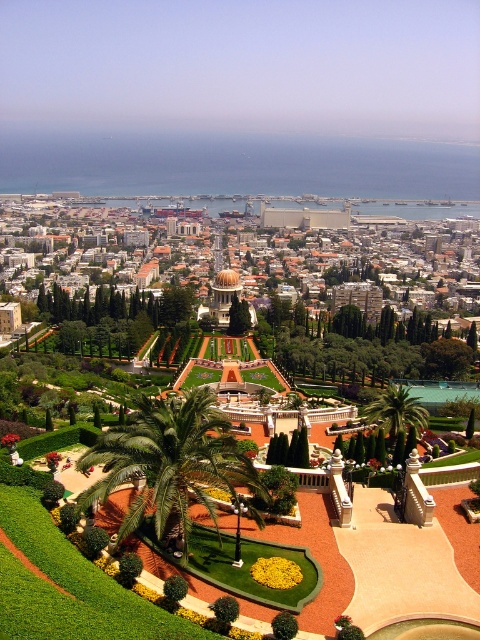
You are a landscape architect designing a pathway between the green leafy palm at center and the green leafy palm tree at center. Which palm has a wider canopy to consider for spacing?

The green leafy palm at center has a wider canopy than the green leafy palm tree at center, so you should consider its width when designing the pathway spacing.

You are standing at the entrance of the coastal cityscape garden and notice two green leafy palm trees. One is labeled as the green leafy palm at center and the other as the green leafy palm tree at center. Which one is taller?

The green leafy palm at center is taller than the green leafy palm tree at center.

You are a visitor standing at the entrance of the coastal cityscape garden. You notice the matte gold dome at center and the green leafy palm at center. Which object would appear larger in your field of view?

The matte gold dome at center would appear larger in your field of view because it is much taller than the green leafy palm at center.